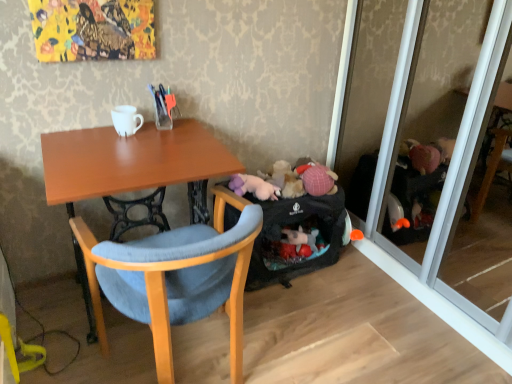
You are a GUI agent. You are given a task and a screenshot of the screen. Output one action in this format:
    pyautogui.click(x=<x>, y=<y>)
    Task: Click on the free space to the right of wooden chair at center
    
    Given the screenshot: What is the action you would take?
    pyautogui.click(x=310, y=339)